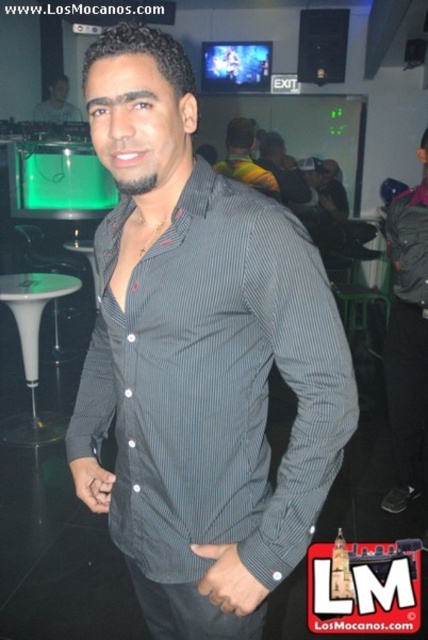
Is point (18, 280) farther from viewer compared to point (363, 301)?

No, it is not.

Is white plastic bar stool at lower left positioned behind green plastic bar stool at center?

That is False.

I want to click on white plastic bar stool at lower left, so click(32, 349).

Find the location of `white plastic bar stool at lower left`. white plastic bar stool at lower left is located at coordinates (32, 349).

Is striped cotton shirt at center bigger than white plastic bar stool at lower left?

Actually, striped cotton shirt at center might be smaller than white plastic bar stool at lower left.

Is striped cotton shirt at center smaller than white plastic bar stool at lower left?

Indeed, striped cotton shirt at center has a smaller size compared to white plastic bar stool at lower left.

Which is behind, point (285, 561) or point (38, 324)?

The point (38, 324) is more distant.

At what (x,y) coordinates should I click in order to perform the action: click on striped cotton shirt at center. Please return your answer as a coordinate pair (x, y). Looking at the image, I should click on (214, 384).

Does white plastic bar stool at lower left have a smaller size compared to striped shirt at center?

No, white plastic bar stool at lower left is not smaller than striped shirt at center.

Who is shorter, white plastic bar stool at lower left or striped shirt at center?

striped shirt at center

This screenshot has width=428, height=640. What do you see at coordinates (32, 349) in the screenshot?
I see `white plastic bar stool at lower left` at bounding box center [32, 349].

The height and width of the screenshot is (640, 428). Identify the location of white plastic bar stool at lower left. (32, 349).